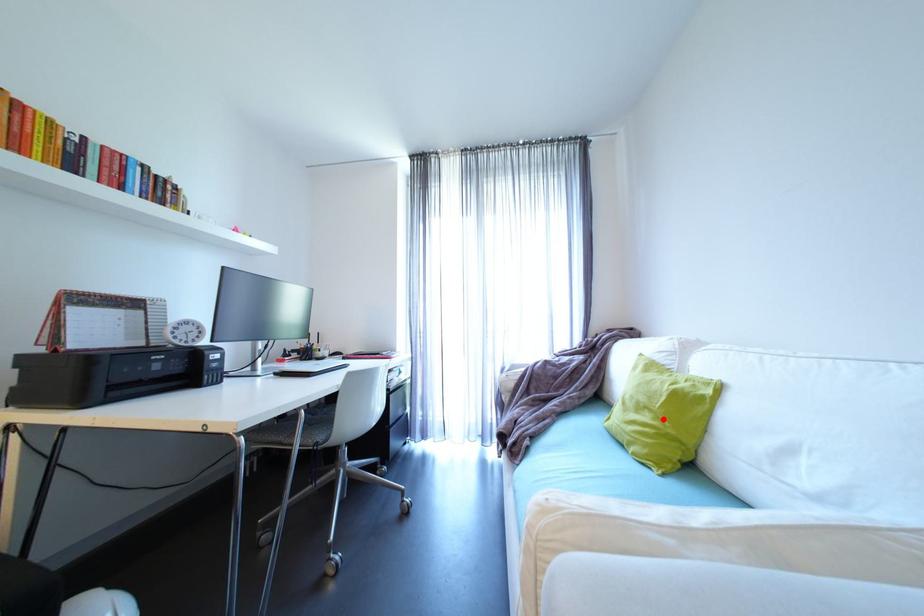
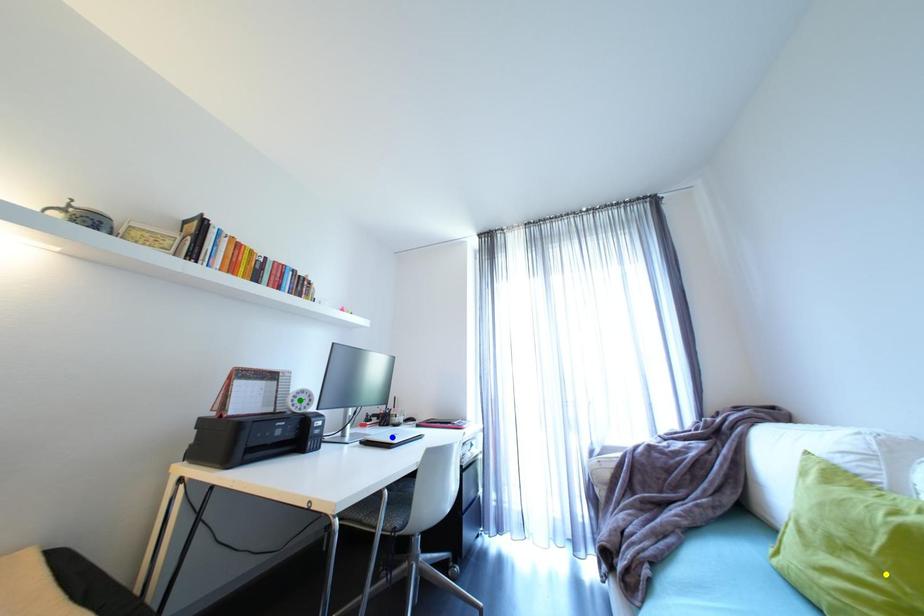
Question: I am providing you with two images of the same scene from different viewpoints. A red point is marked on the first image. You are given multiple points on the second image. Can you choose the point in image 2 that corresponds to the point in image 1?

Choices:
 (A) yellow point
 (B) green point
 (C) blue point

Answer: (A)